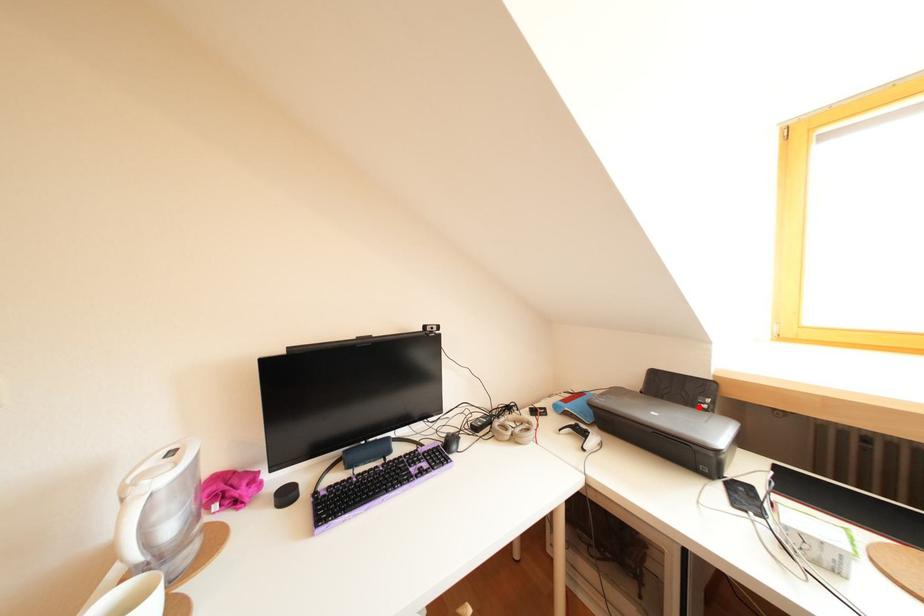
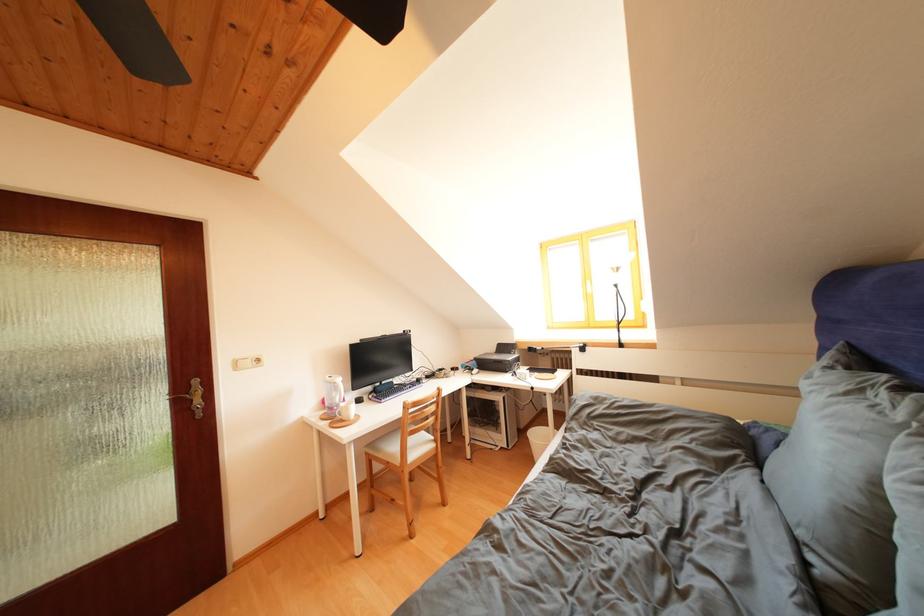
Find the pixel in the second image that matches the highlighted location in the first image.

(517, 358)